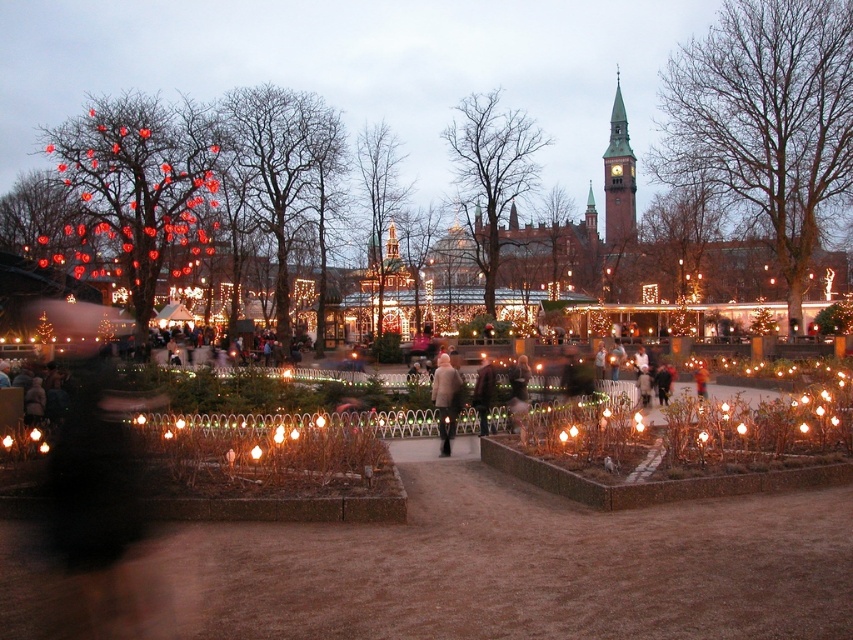
You are standing in the festive outdoor scene and notice a smooth bark tree at center and a light brown leather jacket at center. Which object is higher in position?

The smooth bark tree at center is positioned over the light brown leather jacket at center, so the smooth bark tree at center is higher in position.

You are a visitor at the park and want to take a photo of both the shiny gold tinsel at center and the green copper clock tower at upper center. Since you can only focus on one object at a time, which object should you position your camera closer to in order to capture both in the frame?

To capture both the shiny gold tinsel at center and the green copper clock tower at upper center in the frame, you should position your camera closer to the shiny gold tinsel at center because it is to the left of the green copper clock tower at upper center, allowing both to be included in the same shot.

You are a photographer positioned at the center of the pathway. You want to take a photo that includes both the shiny gold tinsel at center and the green copper clock tower at upper center. Given that your camera can focus on objects up to 50 meters away, will both objects be in focus?

The shiny gold tinsel at center is 53.19 meters away from the green copper clock tower at upper center. Since the camera can only focus up to 50 meters, the distance between them is too great for both to be in focus simultaneously.